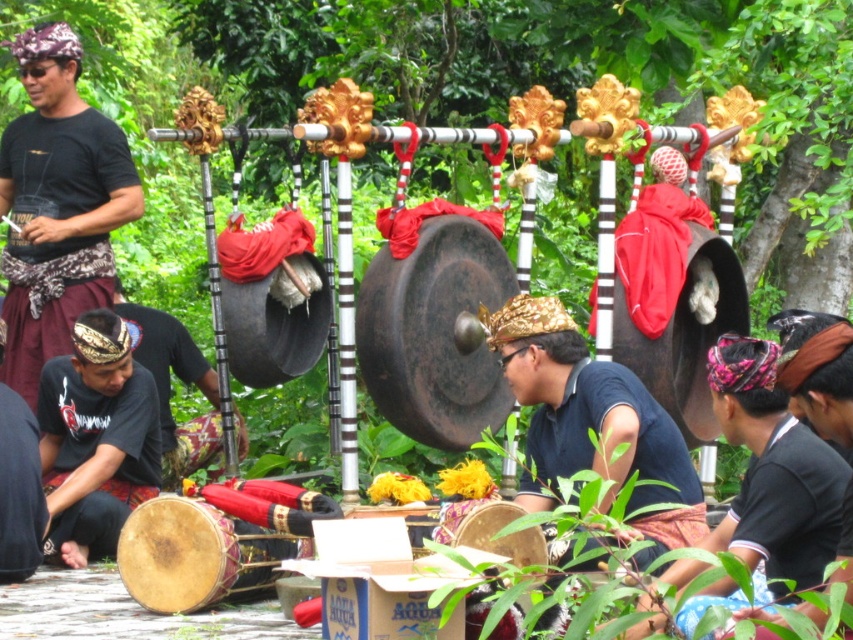
Question: Which object is farther from the camera taking this photo?

Choices:
 (A) matte gold crown at center
 (B) dark blue shirt at center
 (C) matte brown shirt at lower left
 (D) matte black drum at lower left

Answer: (D)

Question: Which object appears closest to the camera in this image?

Choices:
 (A) matte black shirt at left
 (B) natural wood drum at lower left

Answer: (B)

Question: Among these points, which one is nearest to the camera?

Choices:
 (A) (128, 502)
 (B) (676, 442)
 (C) (720, 426)
 (D) (84, 269)

Answer: (C)

Question: Is natural wood drum at lower left closer to camera compared to matte black drum at lower left?

Choices:
 (A) yes
 (B) no

Answer: (A)

Question: Considering the relative positions of natural wood drum at lower left and matte black drum at lower left in the image provided, where is natural wood drum at lower left located with respect to matte black drum at lower left?

Choices:
 (A) below
 (B) above

Answer: (A)

Question: Is dark blue shirt at center above matte black drum at lower left?

Choices:
 (A) yes
 (B) no

Answer: (B)